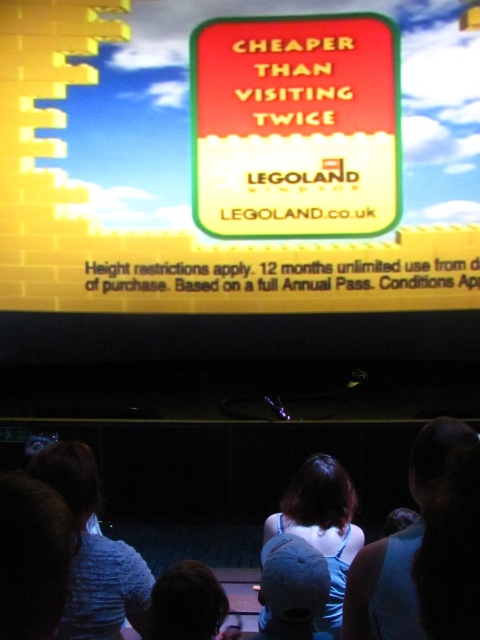
Does point (151, 476) come behind point (262, 627)?

Yes, it is behind point (262, 627).

Which is below, light blue denim shirt at center or denim cap at center?

light blue denim shirt at center is below.

Between point (257, 460) and point (295, 636), which one is positioned behind?

The point (257, 460) is more distant.

Where is `light blue denim shirt at center`? The image size is (480, 640). light blue denim shirt at center is located at coordinates point(223,476).

Can you confirm if light blue denim shirt at center is bigger than light blue shirt at lower left?

Correct, light blue denim shirt at center is larger in size than light blue shirt at lower left.

Does light blue denim shirt at center have a smaller size compared to light blue shirt at lower left?

No, light blue denim shirt at center is not smaller than light blue shirt at lower left.

In order to click on light blue denim shirt at center in this screenshot , I will do `click(223, 476)`.

Who is more distant from viewer, (474, 280) or (432, 483)?

The point (474, 280) is behind.

How distant is yellow matte sign at upper center from dark blue fabric shirt at center?

3.77 meters

Between point (384, 259) and point (386, 589), which one is positioned in front?

Point (386, 589)

Locate an element on the screen. yellow matte sign at upper center is located at coordinates (191, 177).